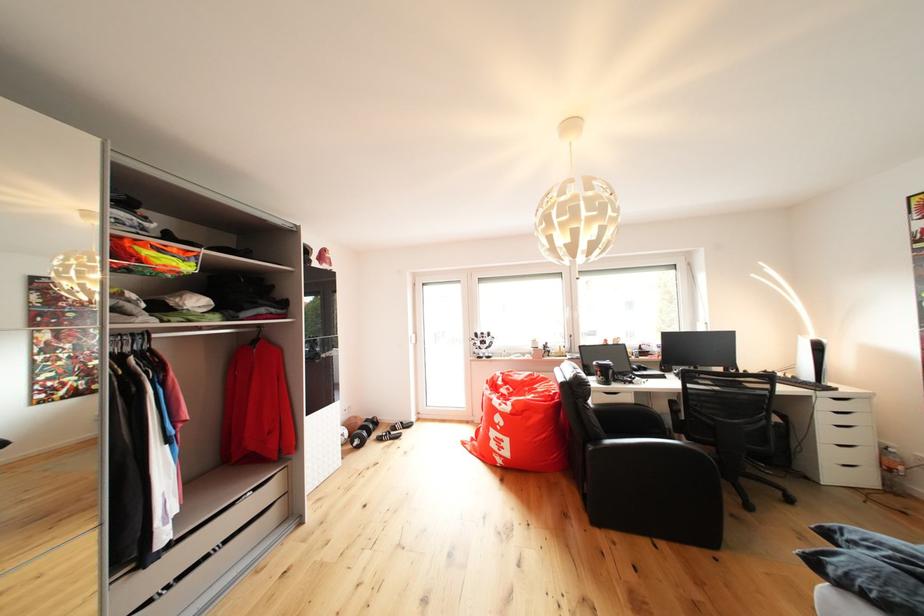
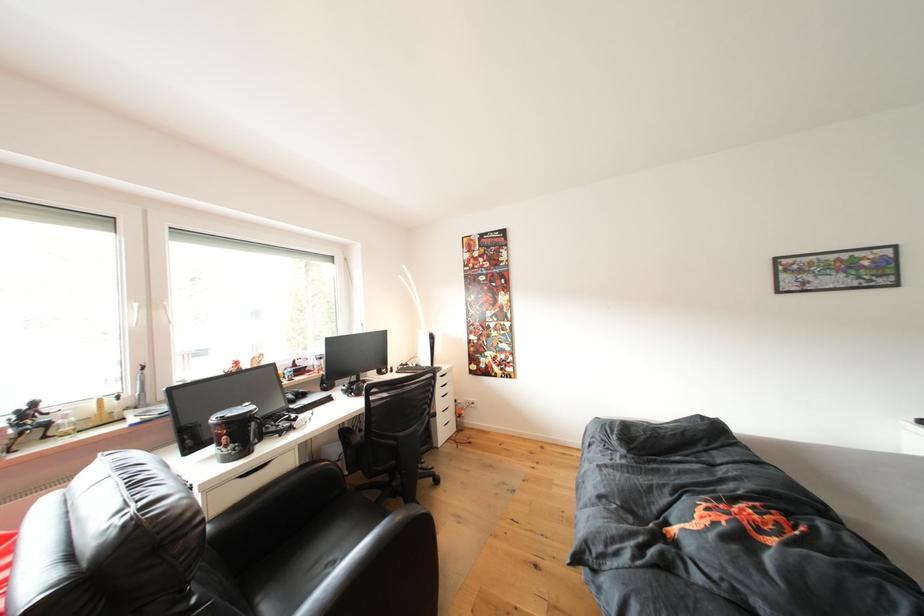
Find the pixel in the second image that matches [553,351] in the first image.

(35, 419)